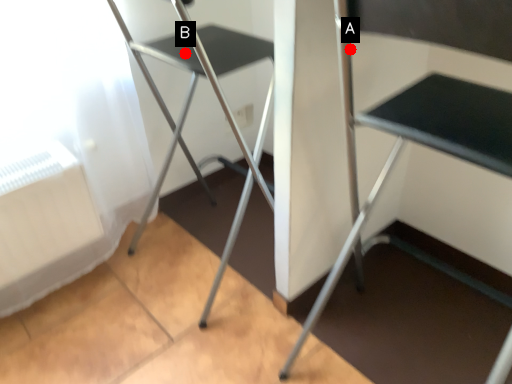
Question: Two points are circled on the image, labeled by A and B beside each circle. Which of the following is the farthest from the observer?

Choices:
 (A) A is further
 (B) B is further

Answer: (B)